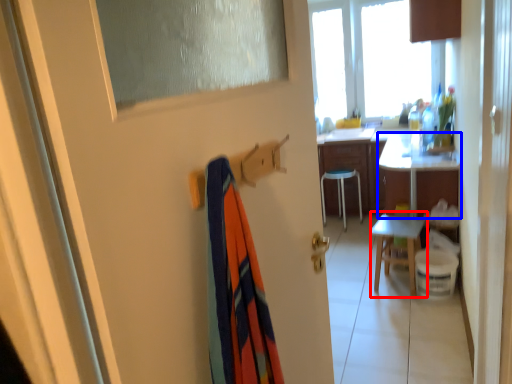
Question: Which object appears farthest to the camera in this image, chair (highlighted by a red box) or desk (highlighted by a blue box)?

Choices:
 (A) chair
 (B) desk

Answer: (B)